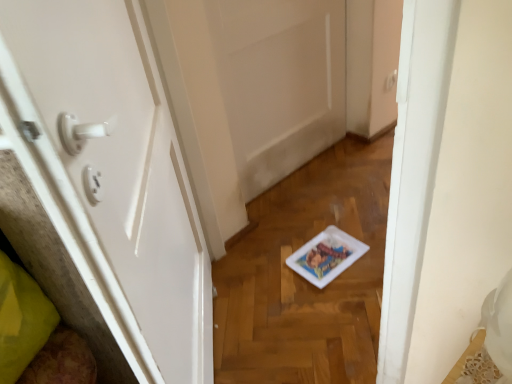
Question: Is white glossy door at left, arranged as the 1th door when viewed from the front, oriented away from white matte door at center, marked as the 2th door in a front-to-back arrangement?

Choices:
 (A) yes
 (B) no

Answer: (B)

Question: Considering the relative sizes of white glossy door at left, which is the 2th door from back to front, and white matte door at center, the 1th door when ordered from back to front, in the image provided, is white glossy door at left, which is the 2th door from back to front, shorter than white matte door at center, the 1th door when ordered from back to front,?

Choices:
 (A) yes
 (B) no

Answer: (B)

Question: Considering the relative positions of white glossy door at left, which is the 2th door from back to front, and white matte door at center, the 1th door when ordered from back to front, in the image provided, is white glossy door at left, which is the 2th door from back to front, to the left of white matte door at center, the 1th door when ordered from back to front, from the viewer's perspective?

Choices:
 (A) yes
 (B) no

Answer: (A)

Question: Does white glossy door at left, arranged as the 1th door when viewed from the front, have a greater height compared to white matte door at center, the 1th door when ordered from back to front?

Choices:
 (A) yes
 (B) no

Answer: (A)

Question: Can you confirm if white glossy door at left, which is the 2th door from back to front, is wider than white matte door at center, marked as the 2th door in a front-to-back arrangement?

Choices:
 (A) no
 (B) yes

Answer: (B)

Question: Can you confirm if white glossy door at left, arranged as the 1th door when viewed from the front, is smaller than white matte door at center, the 1th door when ordered from back to front?

Choices:
 (A) no
 (B) yes

Answer: (A)

Question: Does white matte door at center, the 1th door when ordered from back to front, lie in front of white glossy door at left, arranged as the 1th door when viewed from the front?

Choices:
 (A) yes
 (B) no

Answer: (B)

Question: Could white glossy door at left, arranged as the 1th door when viewed from the front, be considered to be inside white matte door at center, marked as the 2th door in a front-to-back arrangement?

Choices:
 (A) yes
 (B) no

Answer: (B)

Question: Is white matte door at center, the 1th door when ordered from back to front, in contact with white glossy door at left, arranged as the 1th door when viewed from the front?

Choices:
 (A) yes
 (B) no

Answer: (B)

Question: Does white matte door at center, marked as the 2th door in a front-to-back arrangement, have a greater height compared to white glossy door at left, which is the 2th door from back to front?

Choices:
 (A) no
 (B) yes

Answer: (A)

Question: From a real-world perspective, is white matte door at center, the 1th door when ordered from back to front, beneath white glossy door at left, arranged as the 1th door when viewed from the front?

Choices:
 (A) yes
 (B) no

Answer: (A)

Question: Is white matte door at center, marked as the 2th door in a front-to-back arrangement, bigger than white glossy door at left, which is the 2th door from back to front?

Choices:
 (A) yes
 (B) no

Answer: (B)

Question: Considering the positions of point (287, 105) and point (162, 355), is point (287, 105) closer or farther from the camera than point (162, 355)?

Choices:
 (A) closer
 (B) farther

Answer: (B)